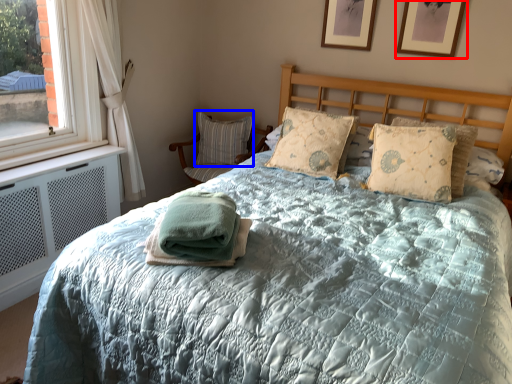
Question: Which object appears closest to the camera in this image, picture frame (highlighted by a red box) or pillow (highlighted by a blue box)?

Choices:
 (A) picture frame
 (B) pillow

Answer: (A)